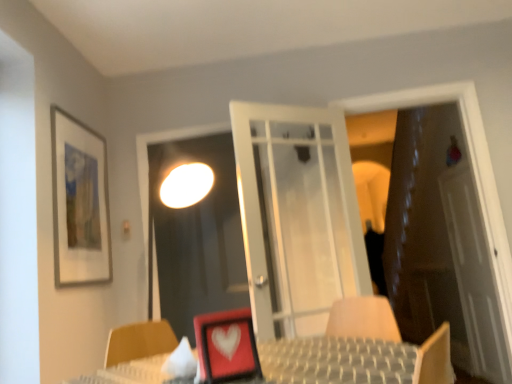
Question: From the image's perspective, is brown leather door at right below white translucent screen door at right, arranged as the 2th screen door when viewed from the front?

Choices:
 (A) no
 (B) yes

Answer: (A)

Question: Is brown leather door at right looking in the opposite direction of white translucent screen door at right, positioned as the 2th screen door in left-to-right order?

Choices:
 (A) yes
 (B) no

Answer: (A)

Question: Is brown leather door at right wider than white translucent screen door at right, positioned as the 2th screen door in left-to-right order?

Choices:
 (A) yes
 (B) no

Answer: (A)

Question: Does brown leather door at right come behind white translucent screen door at right, which is counted as the 1th screen door, starting from the back?

Choices:
 (A) no
 (B) yes

Answer: (A)

Question: Is brown leather door at right positioned beyond the bounds of white translucent screen door at right, which is counted as the 1th screen door, starting from the back?

Choices:
 (A) no
 (B) yes

Answer: (B)

Question: Is white translucent screen door at right, which is counted as the 1th screen door, starting from the back, taller or shorter than transparent glass screen door at center, the first screen door in the left-to-right sequence?

Choices:
 (A) short
 (B) tall

Answer: (B)

Question: Looking at the image, does white translucent screen door at right, arranged as the 2th screen door when viewed from the front, seem bigger or smaller compared to transparent glass screen door at center, which is counted as the second screen door, starting from the right?

Choices:
 (A) small
 (B) big

Answer: (B)

Question: Visually, is white translucent screen door at right, positioned as the 2th screen door in left-to-right order, positioned to the left or to the right of transparent glass screen door at center, the first screen door in the left-to-right sequence?

Choices:
 (A) left
 (B) right

Answer: (B)

Question: In terms of width, does white translucent screen door at right, positioned as the 2th screen door in left-to-right order, look wider or thinner when compared to transparent glass screen door at center, placed as the first screen door when sorted from front to back?

Choices:
 (A) wide
 (B) thin

Answer: (A)

Question: Considering the positions of white translucent screen door at right, arranged as the 2th screen door when viewed from the front, and brown leather door at right in the image, is white translucent screen door at right, arranged as the 2th screen door when viewed from the front, wider or thinner than brown leather door at right?

Choices:
 (A) wide
 (B) thin

Answer: (B)

Question: From the image's perspective, is white translucent screen door at right, marked as the 1th screen door in a right-to-left arrangement, located above or below brown leather door at right?

Choices:
 (A) below
 (B) above

Answer: (A)

Question: Is white translucent screen door at right, marked as the 1th screen door in a right-to-left arrangement, inside the boundaries of brown leather door at right, or outside?

Choices:
 (A) inside
 (B) outside

Answer: (B)

Question: In terms of height, does white translucent screen door at right, marked as the 1th screen door in a right-to-left arrangement, look taller or shorter compared to brown leather door at right?

Choices:
 (A) tall
 (B) short

Answer: (B)

Question: Considering the positions of point (441, 203) and point (75, 137), is point (441, 203) closer or farther from the camera than point (75, 137)?

Choices:
 (A) farther
 (B) closer

Answer: (A)

Question: In terms of size, does brown leather door at right appear bigger or smaller than matte glass picture frame at upper left, positioned as the 2th picture frame in front-to-back order?

Choices:
 (A) small
 (B) big

Answer: (B)